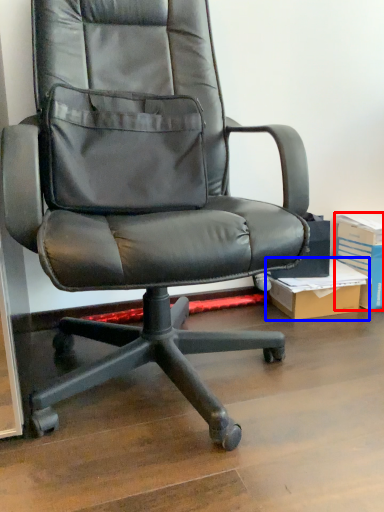
Question: Among these objects, which one is farthest to the camera, paperback book (highlighted by a red box) or cardboard box (highlighted by a blue box)?

Choices:
 (A) paperback book
 (B) cardboard box

Answer: (A)